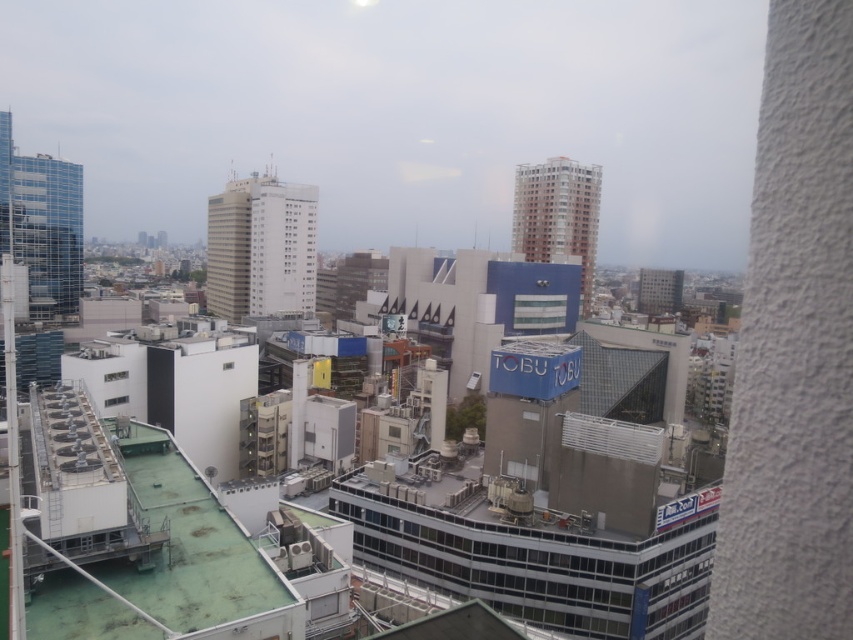
Is white plastic window at lower left closer to the viewer compared to transparent glass window at center?

Yes, white plastic window at lower left is closer to the viewer.

Between white plastic window at lower left and transparent glass window at center, which one has more height?

transparent glass window at center

Is point (105, 403) positioned after point (109, 372)?

No, it is not.

Find the location of a particular element. The height and width of the screenshot is (640, 853). white plastic window at lower left is located at coordinates (115, 401).